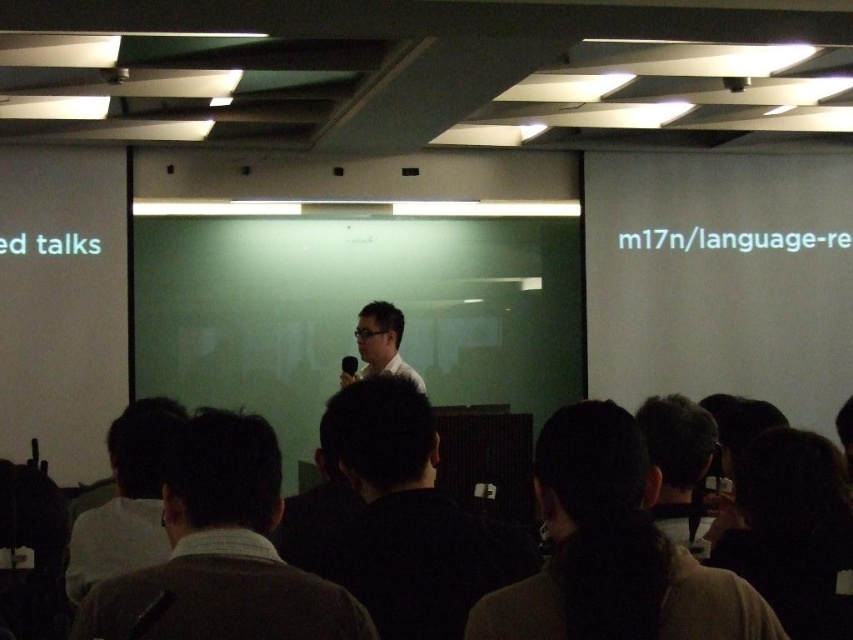
You are an event organizer planning to adjust the lighting for a presentation. You notice the dark brown hair at center and the white matte shirt at center. Which object might be more challenging to illuminate effectively due to its size, and why?

The dark brown hair at center might be more challenging to illuminate effectively because it occupies less space than the white matte shirt at center, making it harder to focus the light appropriately.

You are a photographer trying to capture a clear shot of the speaker. The speaker has dark brown hair at center and a white matte shirt at center. Since you want to focus on their face, which object should you ensure is in the foreground?

dark brown hair at center should be in the foreground because it is in front of white matte shirt at center, ensuring the face is focused.